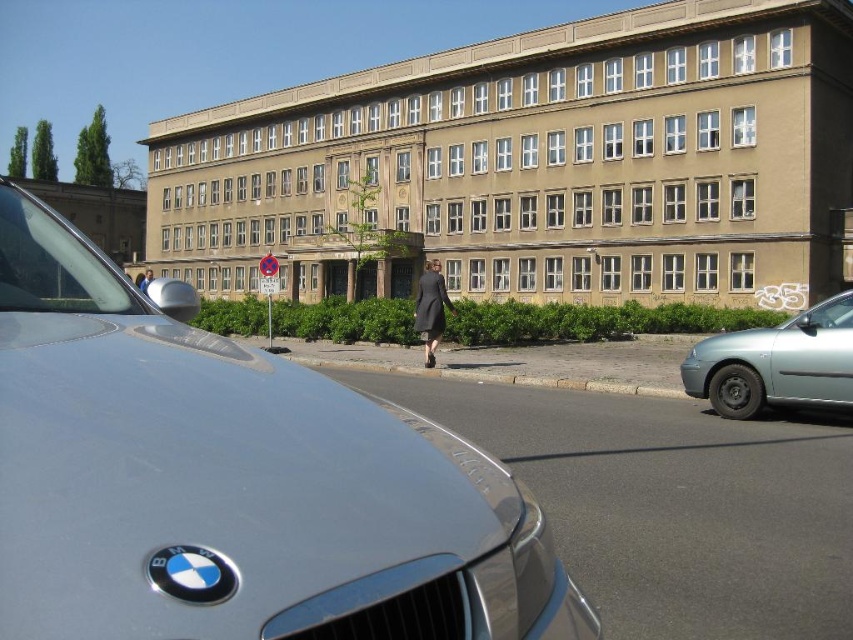
Question: Which point is farther to the camera?

Choices:
 (A) (422, 289)
 (B) (757, 349)

Answer: (A)

Question: Which object is positioned closest to the silver metallic sedan at right?

Choices:
 (A) blue fabric jacket at center
 (B) sleek silver car at center

Answer: (B)

Question: Which point is farther from the camera taking this photo?

Choices:
 (A) (727, 413)
 (B) (148, 280)

Answer: (B)

Question: Is sleek silver car at center to the right of silver metallic sedan at right from the viewer's perspective?

Choices:
 (A) yes
 (B) no

Answer: (B)

Question: Can you confirm if silver metallic sedan at right is positioned to the right of matte black coat at center?

Choices:
 (A) yes
 (B) no

Answer: (A)

Question: Is silver metallic sedan at right in front of blue fabric jacket at center?

Choices:
 (A) no
 (B) yes

Answer: (B)